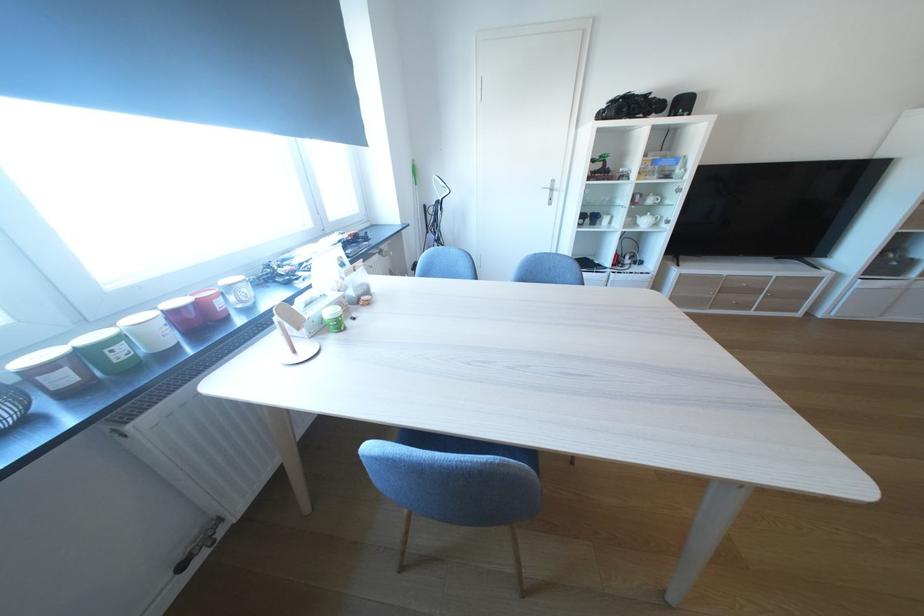
Find where to sit the blue chair sitting surface. Please return your answer as a coordinate pair (x, y).

(569, 456)